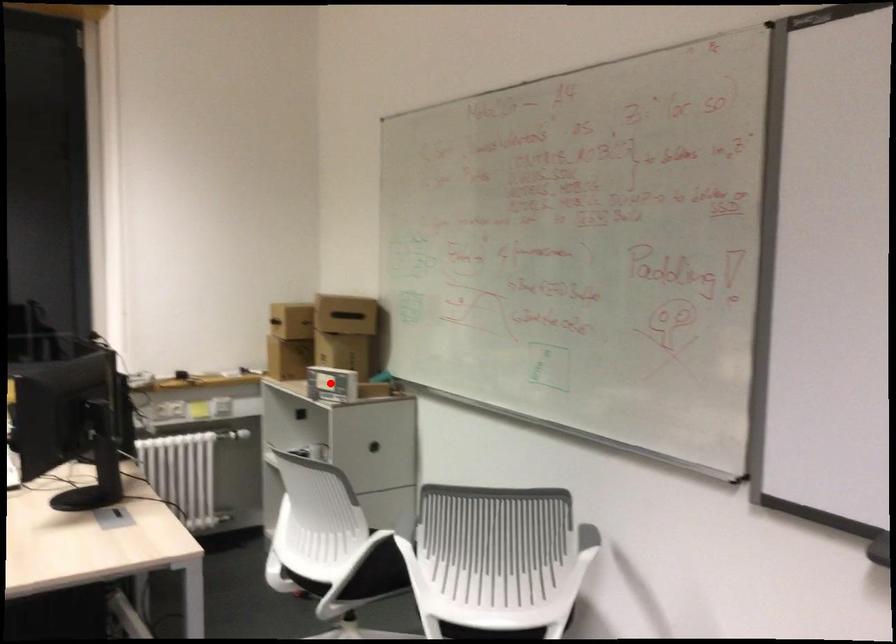
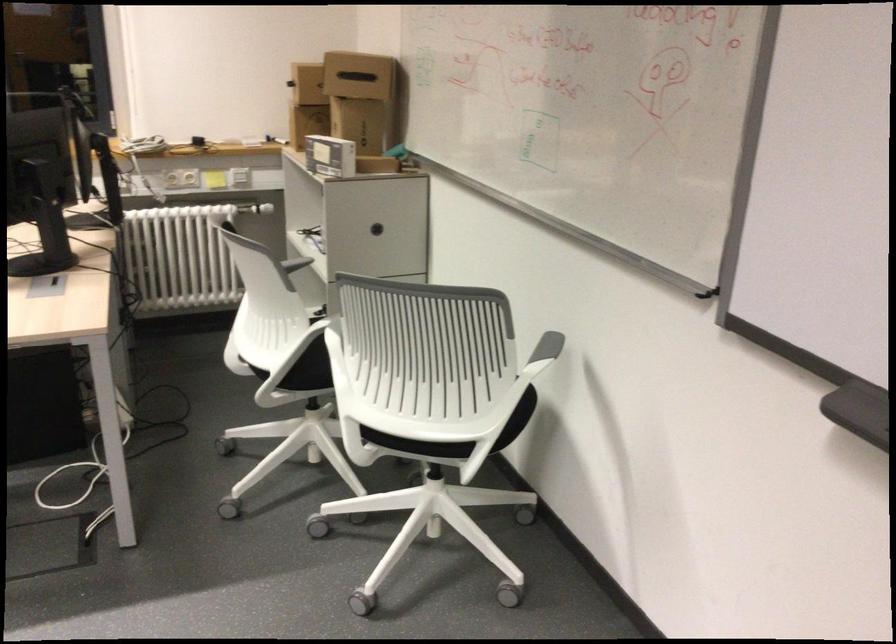
The point at the highlighted location is marked in the first image. Where is the corresponding point in the second image?

(330, 156)